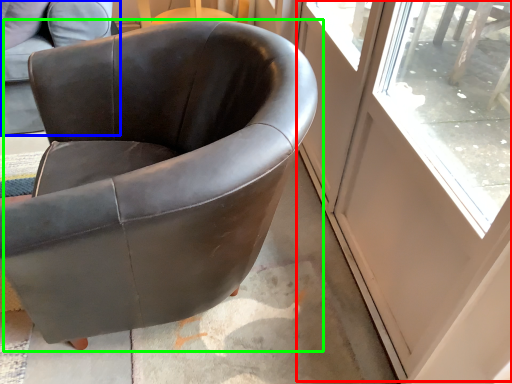
Question: Estimate the real-world distances between objects in this image. Which object is farther from screen door (highlighted by a red box), chair (highlighted by a blue box) or chair (highlighted by a green box)?

Choices:
 (A) chair
 (B) chair

Answer: (A)